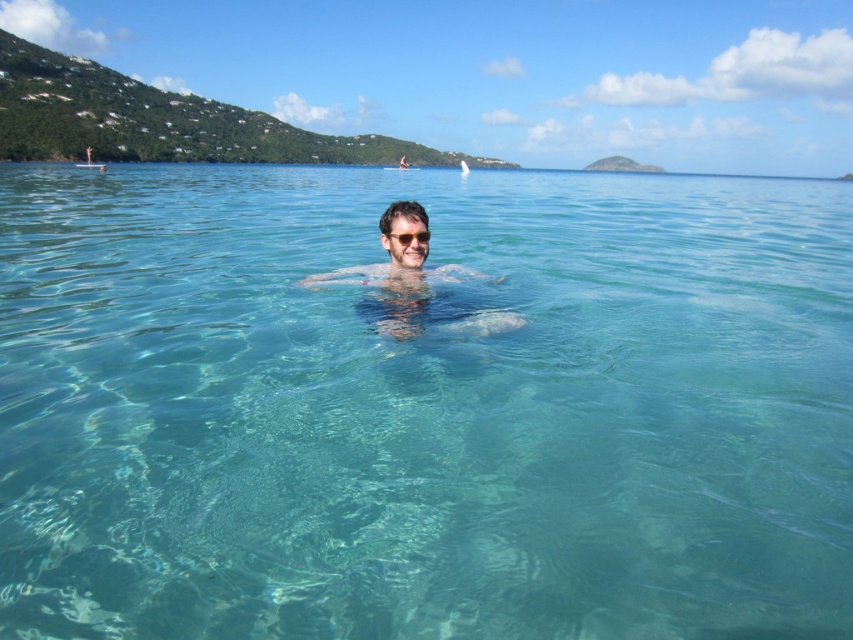
Is matte skin at center wider than transparent plastic goggles at center?

Yes, matte skin at center is wider than transparent plastic goggles at center.

Is matte skin at center thinner than transparent plastic goggles at center?

In fact, matte skin at center might be wider than transparent plastic goggles at center.

Between point (401, 305) and point (390, 230), which one is positioned behind?

Point (390, 230)

Locate an element on the screen. matte skin at center is located at coordinates (397, 275).

Is clear water at center in front of matte skin at center?

Yes, it is.

Is clear water at center to the right of matte skin at center from the viewer's perspective?

A: Yes, clear water at center is to the right of matte skin at center.

Is point (496, 218) farther from viewer compared to point (393, 280)?

Yes, it is behind point (393, 280).

Where is `clear water at center`? This screenshot has height=640, width=853. clear water at center is located at coordinates (422, 408).

Between point (775, 412) and point (395, 232), which one is positioned in front?

Point (775, 412)

What do you see at coordinates (422, 408) in the screenshot?
I see `clear water at center` at bounding box center [422, 408].

What do you see at coordinates (422, 408) in the screenshot? This screenshot has width=853, height=640. I see `clear water at center` at bounding box center [422, 408].

The image size is (853, 640). Find the location of `clear water at center`. clear water at center is located at coordinates 422,408.